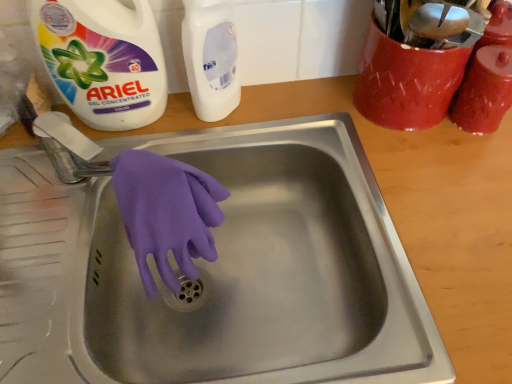
Identify the location of vacant region to the right of white matte bottle at upper center, acting as the 2th cleaning product starting from the left. This screenshot has width=512, height=384. (294, 118).